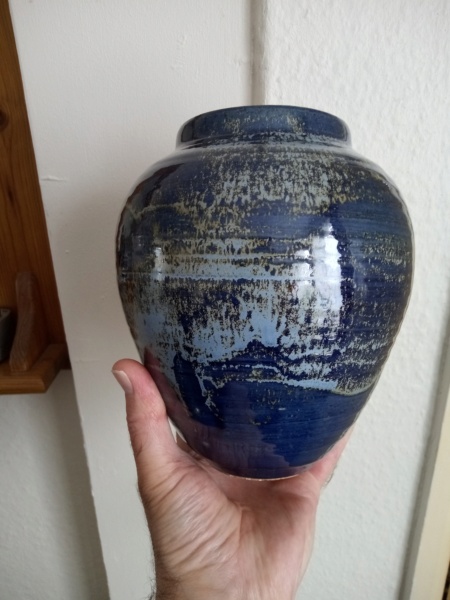
Identify the location of shelf. (41, 389).